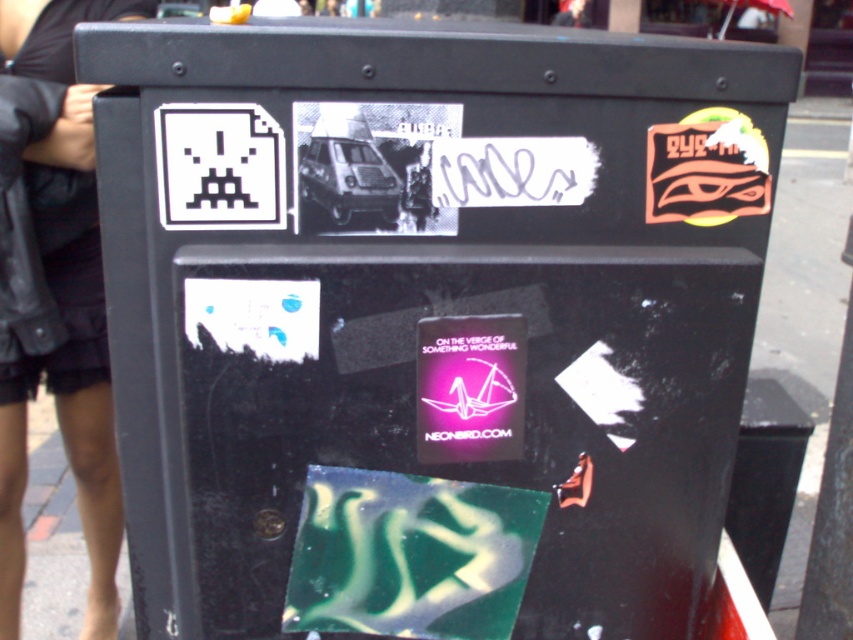
Question: Which point is farther to the camera?

Choices:
 (A) black leather jacket at upper left
 (B) white pixelated alien at upper left

Answer: (A)

Question: Is black leather jacket at upper left smaller than white pixelated alien at upper left?

Choices:
 (A) yes
 (B) no

Answer: (B)

Question: Does black leather jacket at upper left appear on the right side of white pixelated alien at upper left?

Choices:
 (A) no
 (B) yes

Answer: (A)

Question: Is black leather jacket at upper left above white pixelated alien at upper left?

Choices:
 (A) no
 (B) yes

Answer: (A)

Question: Which of the following is the closest to the observer?

Choices:
 (A) white pixelated alien at upper left
 (B) black leather jacket at upper left

Answer: (A)